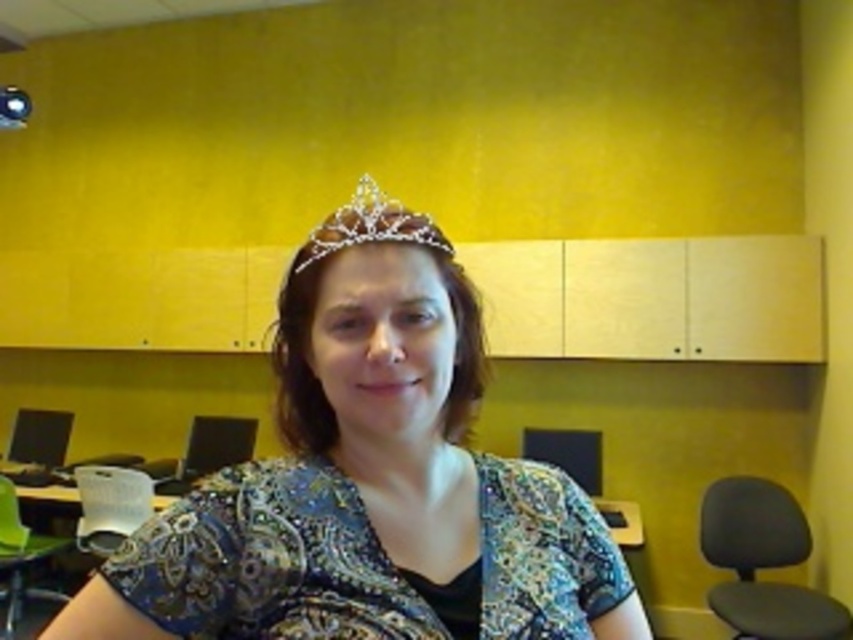
You are organizing a photoshoot and need to ensure that the clear crystal tiara at center is visible above the white plastic chair at lower left in the final image. Based on their sizes, will the tiara be fully visible without obstruction?

The clear crystal tiara at center is shorter than the white plastic chair at lower left, so it will not be fully visible above the chair as it is shorter and may be obstructed by the chair.

You are an interior designer planning to place a new lamp between the sparkly blue dress at center and the green fabric chair at lower left. Based on their heights, which object should the lamp be positioned closer to?

The lamp should be positioned closer to the sparkly blue dress at center because it has a lesser height compared to the green fabric chair at lower left, so placing the lamp closer to the shorter object would create a balanced arrangement.

You are standing in a classroom and want to reach a specific point in the room. The point is located at coordinates point [392,225]. If your arm can extend 28 inches, can you reach that point without moving your feet?

The distance of point [392,225] from viewer is 29.17 inches, so no, you cannot reach it with an arm extension of 28 inches as it is 1.17 inches out of reach.